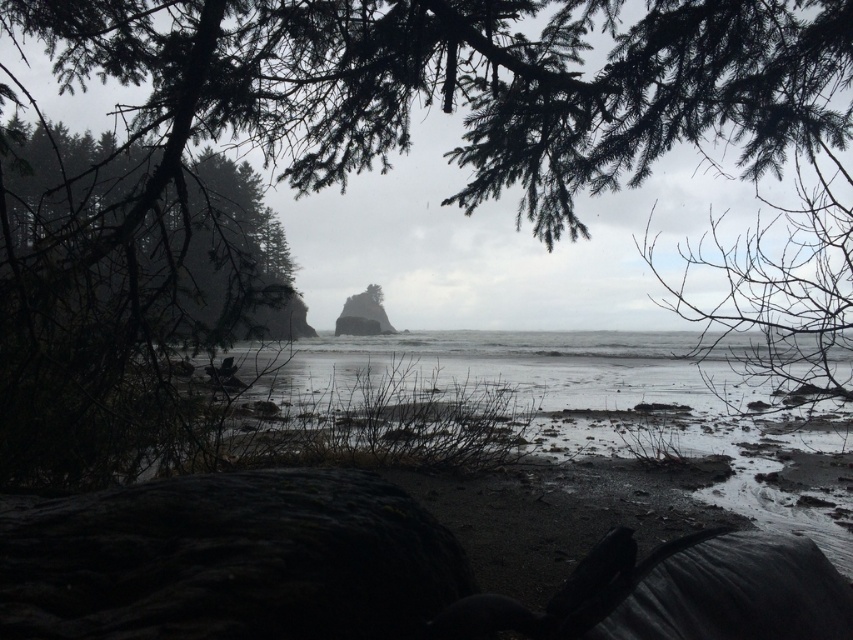
Question: Does gray matte water at center appear under dark green textured tree at left?

Choices:
 (A) no
 (B) yes

Answer: (B)

Question: Which point appears closest to the camera in this image?

Choices:
 (A) (450, 364)
 (B) (15, 218)

Answer: (B)

Question: Does gray matte water at center have a larger size compared to dark green textured tree at left?

Choices:
 (A) no
 (B) yes

Answer: (A)

Question: Among these objects, which one is farthest from the camera?

Choices:
 (A) dark green textured tree at left
 (B) gray matte water at center

Answer: (B)

Question: Which point is closer to the camera?

Choices:
 (A) dark green textured tree at left
 (B) gray matte water at center

Answer: (A)

Question: Does gray matte water at center have a greater width compared to dark green textured tree at left?

Choices:
 (A) no
 (B) yes

Answer: (A)